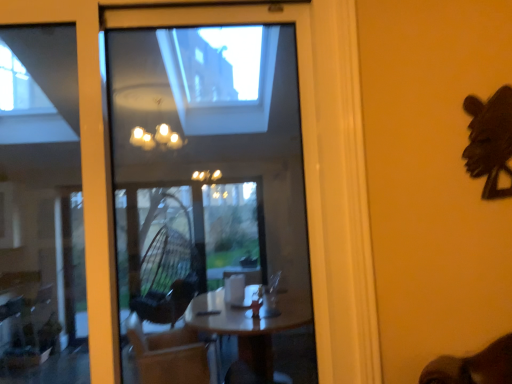
Question: Are transparent glass window at center and black matte mask at upper right located far from each other?

Choices:
 (A) no
 (B) yes

Answer: (A)

Question: Can you confirm if transparent glass window at center is bigger than black matte mask at upper right?

Choices:
 (A) yes
 (B) no

Answer: (A)

Question: Does transparent glass window at center appear on the left side of black matte mask at upper right?

Choices:
 (A) no
 (B) yes

Answer: (B)

Question: Can you confirm if transparent glass window at center is wider than black matte mask at upper right?

Choices:
 (A) no
 (B) yes

Answer: (B)

Question: From the image's perspective, does transparent glass window at center appear higher than black matte mask at upper right?

Choices:
 (A) yes
 (B) no

Answer: (B)

Question: Is transparent glass window at center positioned with its back to black matte mask at upper right?

Choices:
 (A) yes
 (B) no

Answer: (B)

Question: From a real-world perspective, is black matte mask at upper right positioned over transparent glass window at center based on gravity?

Choices:
 (A) no
 (B) yes

Answer: (B)

Question: Can you confirm if black matte mask at upper right is taller than transparent glass window at center?

Choices:
 (A) no
 (B) yes

Answer: (A)

Question: Does black matte mask at upper right have a larger size compared to transparent glass window at center?

Choices:
 (A) yes
 (B) no

Answer: (B)

Question: Is black matte mask at upper right smaller than transparent glass window at center?

Choices:
 (A) no
 (B) yes

Answer: (B)

Question: From the image's perspective, is black matte mask at upper right above transparent glass window at center?

Choices:
 (A) yes
 (B) no

Answer: (A)

Question: Are black matte mask at upper right and transparent glass window at center located far from each other?

Choices:
 (A) yes
 (B) no

Answer: (B)

Question: From their relative heights in the image, would you say black matte mask at upper right is taller or shorter than transparent glass window at center?

Choices:
 (A) tall
 (B) short

Answer: (B)